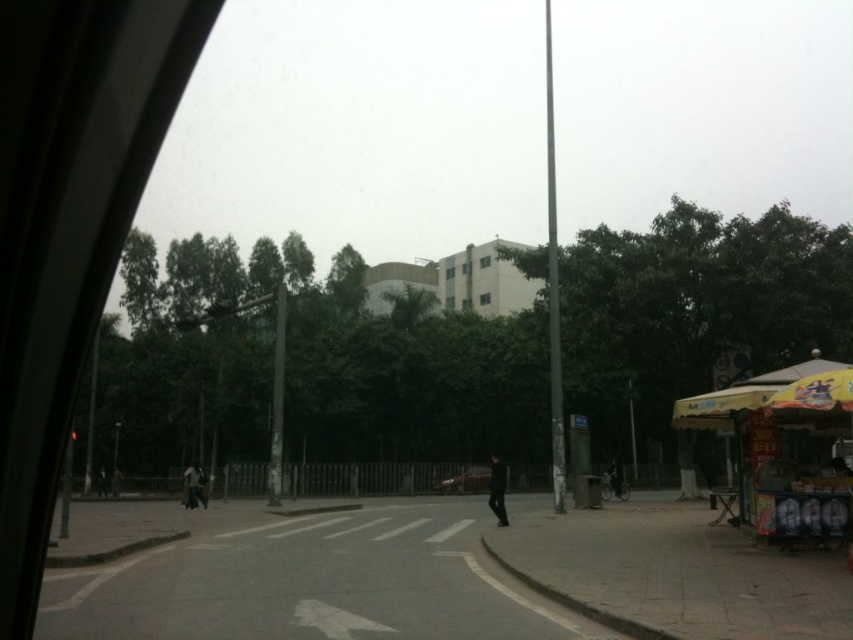
You are a passenger in the car and notice the silver metallic pole at center and the dark gray pants at center through the window. Which object is closer to the window?

The silver metallic pole at center is positioned over dark gray pants at center, meaning it is closer to the window than the dark gray pants at center.

You are a driver waiting at a traffic light and see the silver metallic pole at center and the dark gray pants at center through the window. Which object appears bigger in your view?

The silver metallic pole at center appears bigger than the dark gray pants at center because it has a larger size.

You are a passenger in the vehicle and notice the shiny red car at center and the metallic pole at left outside the window. Which object is closer to the bottom edge of the window frame?

The shiny red car at center is closer to the bottom edge of the window frame because it is positioned below the metallic pole at left.